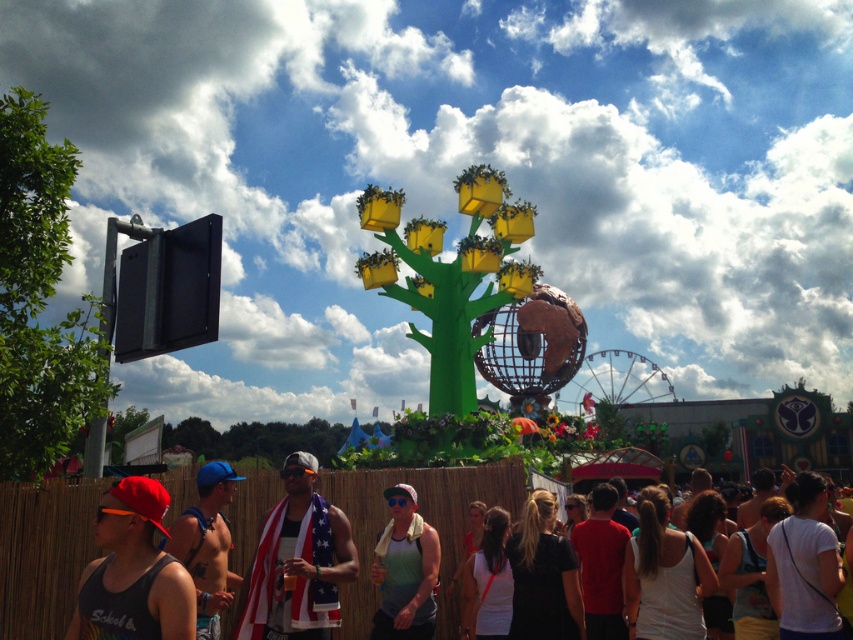
You are a photographer standing at the green matte tree at left and want to take a photo of the green matte tank top at center without any obstructions. Given that the distance between them is 54.35 meters, can you estimate whether you can clearly capture the tank top in your photo considering typical camera lens capabilities?

The distance between the green matte tree at left and the green matte tank top at center is 54.35 meters. With a standard camera lens, capturing such a distant object clearly might be challenging due to the significant distance. A telephoto lens would be necessary to zoom in and capture the green matte tank top at center clearly without obstructions.

You are an attendee at the festival. You see a green matte tree at left and a green matte tank top at center. Which object is closer to you?

The green matte tree at left is closer to you because it is positioned over the green matte tank top at center, indicating it is in front.